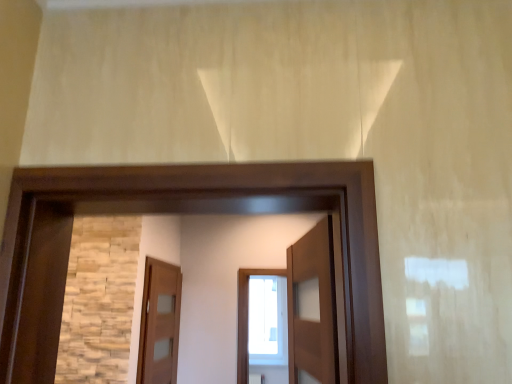
Question: Should I look upward or downward to see matte wood door at center?

Choices:
 (A) up
 (B) down

Answer: (B)